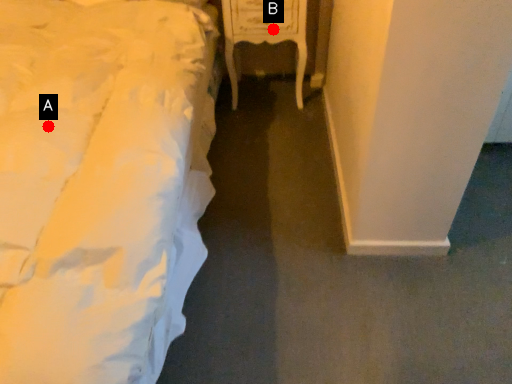
Question: Two points are circled on the image, labeled by A and B beside each circle. Which point is closer to the camera?

Choices:
 (A) A is closer
 (B) B is closer

Answer: (A)